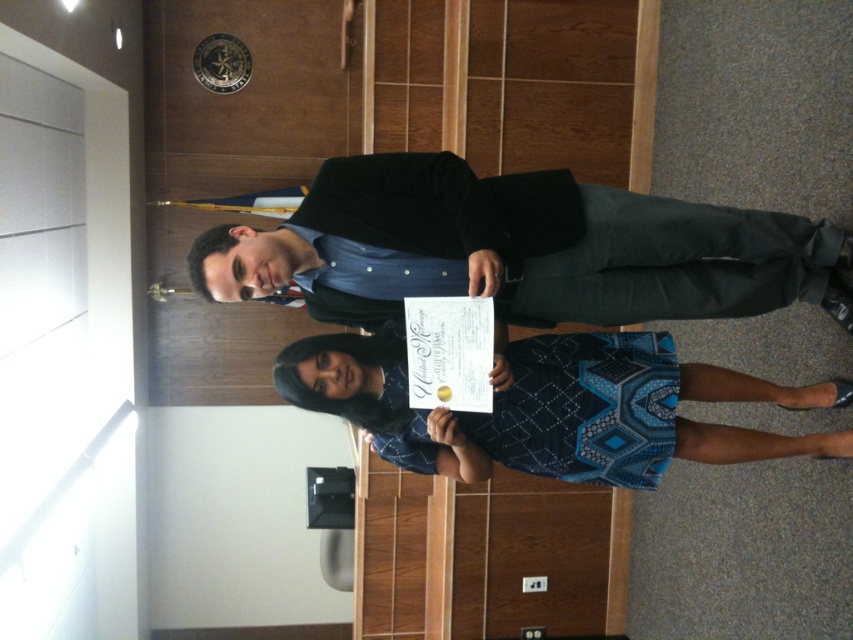
Which is more to the left, black smooth suit at center or blue printed fabric dress at center?

blue printed fabric dress at center

Is point (625, 246) closer to viewer compared to point (608, 406)?

That is True.

The image size is (853, 640). Find the location of `black smooth suit at center`. black smooth suit at center is located at coordinates pos(544,244).